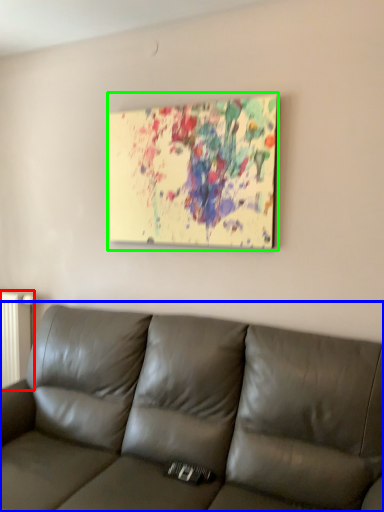
Question: Which is nearer to the radiator (highlighted by a red box)? studio couch (highlighted by a blue box) or picture frame (highlighted by a green box).

Choices:
 (A) studio couch
 (B) picture frame

Answer: (A)